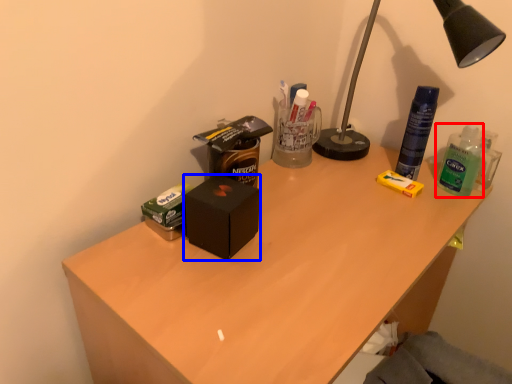
Question: Which point is closer to the camera, bottle (highlighted by a red box) or box (highlighted by a blue box)?

Choices:
 (A) bottle
 (B) box

Answer: (B)